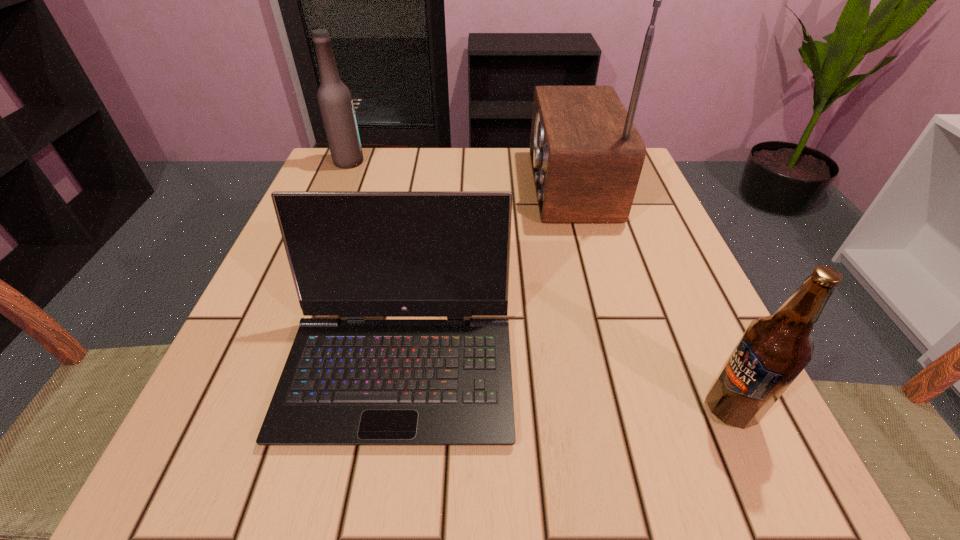
Identify the location of the tallest object. Image resolution: width=960 pixels, height=540 pixels. (586, 154).

I want to click on the third object from left to right, so click(586, 154).

Find the location of `the left beer bottle`. the left beer bottle is located at coordinates (335, 102).

I want to click on the leftmost object, so click(x=335, y=102).

This screenshot has height=540, width=960. I want to click on the shorter beer bottle, so click(773, 351).

Locate an element on the screen. The image size is (960, 540). the right beer bottle is located at coordinates (773, 351).

Identify the location of the second object from left to right. (346, 382).

Image resolution: width=960 pixels, height=540 pixels. I want to click on vacant region located on the front-facing side of the second object from right to left, so click(496, 185).

Where is `free location located 0.170m on the front-facing side of the second object from right to left`? The height and width of the screenshot is (540, 960). free location located 0.170m on the front-facing side of the second object from right to left is located at coordinates (451, 185).

You are a GUI agent. You are given a task and a screenshot of the screen. Output one action in this format:
    pyautogui.click(x=<x>, y=<y>)
    Task: Click on the blank space located 0.150m on the front-facing side of the second object from right to left
    This screenshot has height=540, width=960.
    Given the screenshot: What is the action you would take?
    pyautogui.click(x=461, y=185)